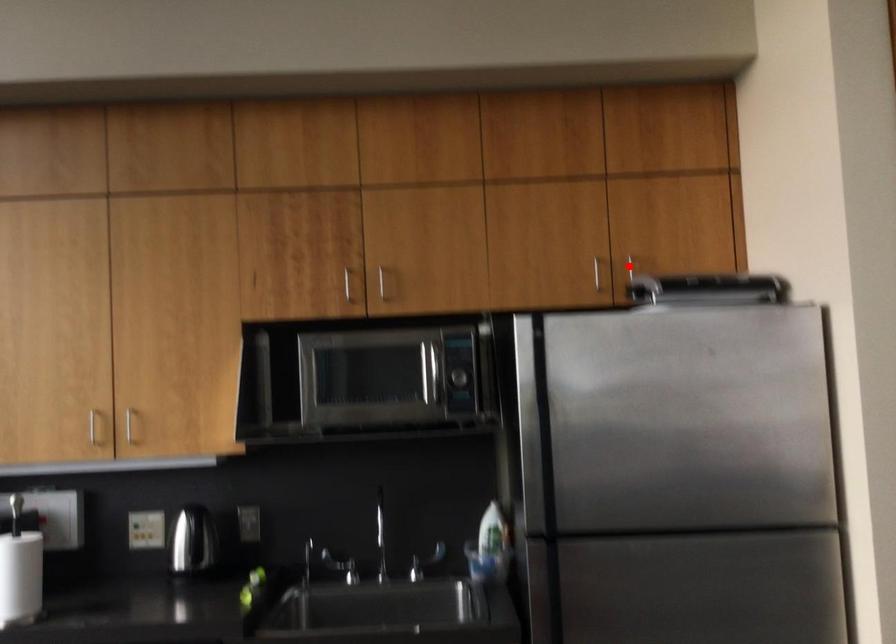
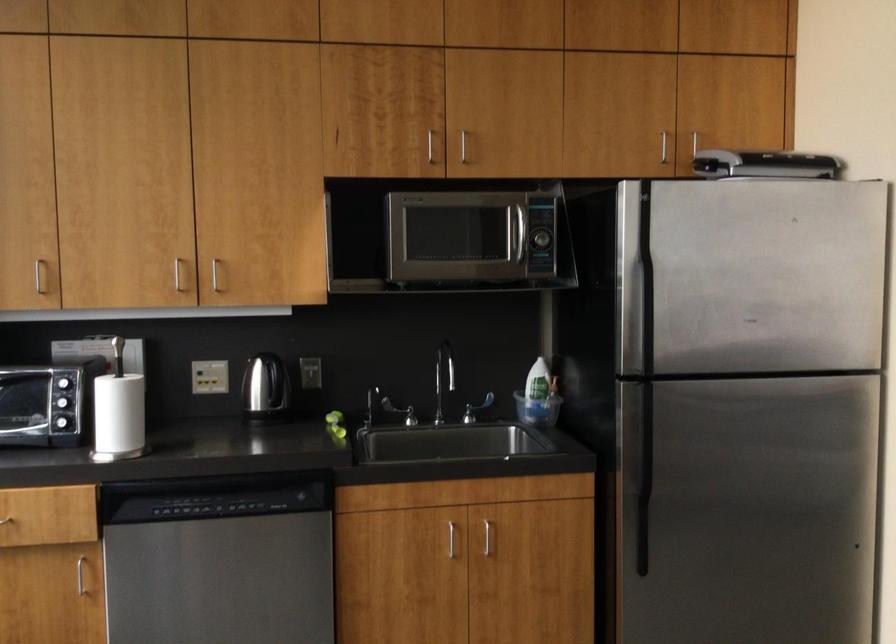
Where in the second image is the point corresponding to the highlighted location from the first image?

(694, 143)